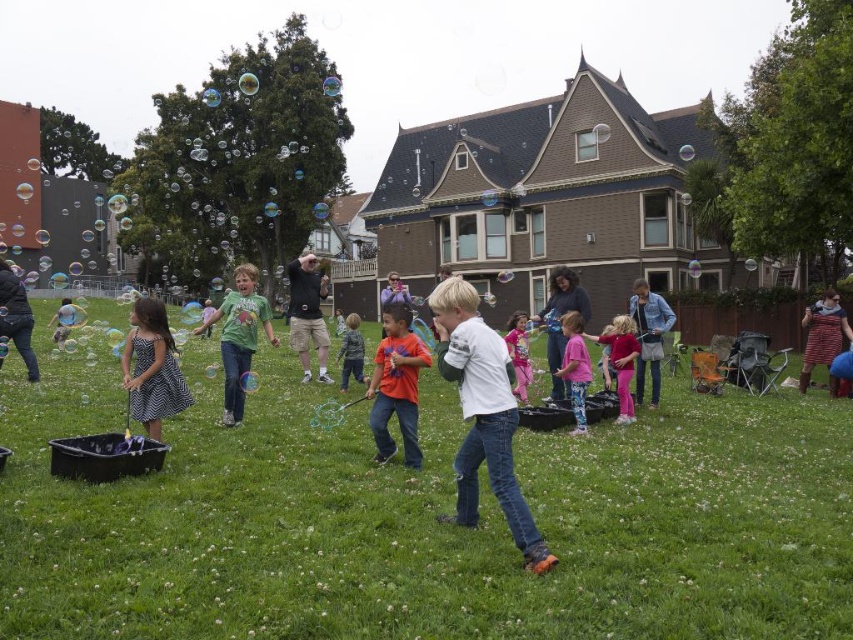
What do you see at coordinates (519, 353) in the screenshot?
I see `pink fabric dress at center` at bounding box center [519, 353].

Based on the photo, between pink fabric dress at center and orange cotton shirt at center, which one appears on the left side from the viewer's perspective?

orange cotton shirt at center

Which is behind, point (508, 333) or point (355, 378)?

Point (355, 378)

Where is `pink fabric dress at center`? The image size is (853, 640). pink fabric dress at center is located at coordinates (519, 353).

Does polka dot dress at left have a lesser width compared to pink fabric shirt at center?

No.

Where is `polka dot dress at left`? polka dot dress at left is located at coordinates (152, 368).

Does point (163, 348) come closer to viewer compared to point (561, 368)?

Yes.

Identify the location of polka dot dress at left. (152, 368).

Which is more to the left, orange matte shirt at center or green matte shirt at center?

green matte shirt at center is more to the left.

Which is behind, point (393, 452) or point (245, 317)?

The point (245, 317) is behind.

Find the location of `orange matte shirt at center`. orange matte shirt at center is located at coordinates (396, 385).